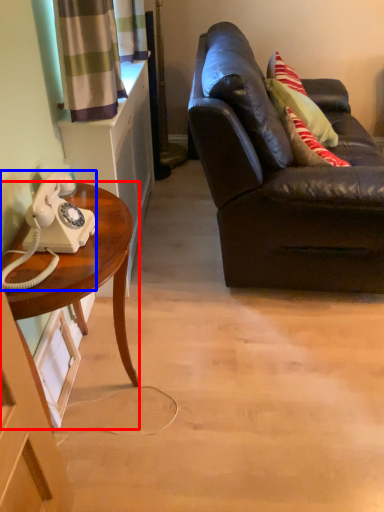
Question: Which object is further to the camera taking this photo, desk (highlighted by a red box) or corded phone (highlighted by a blue box)?

Choices:
 (A) desk
 (B) corded phone

Answer: (A)